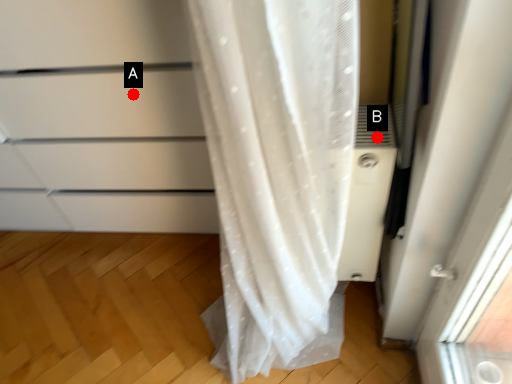
Question: Two points are circled on the image, labeled by A and B beside each circle. Among these points, which one is nearest to the camera?

Choices:
 (A) A is closer
 (B) B is closer

Answer: (B)